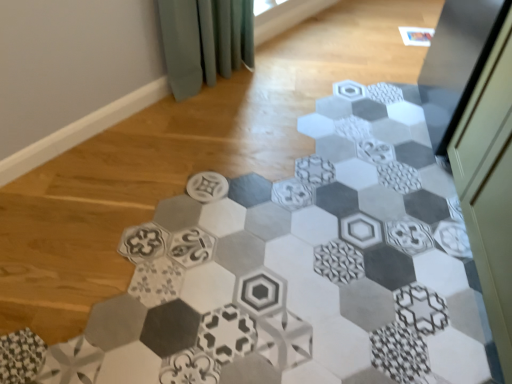
Locate an element on the screen. free spot in front of white glossy picture frame at upper right is located at coordinates (431, 57).